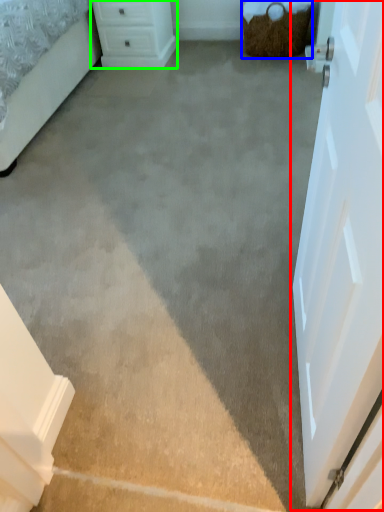
Question: Estimate the real-world distances between objects in this image. Which object is farther from door (highlighted by a red box), basket (highlighted by a blue box) or chest of drawers (highlighted by a green box)?

Choices:
 (A) basket
 (B) chest of drawers

Answer: (B)